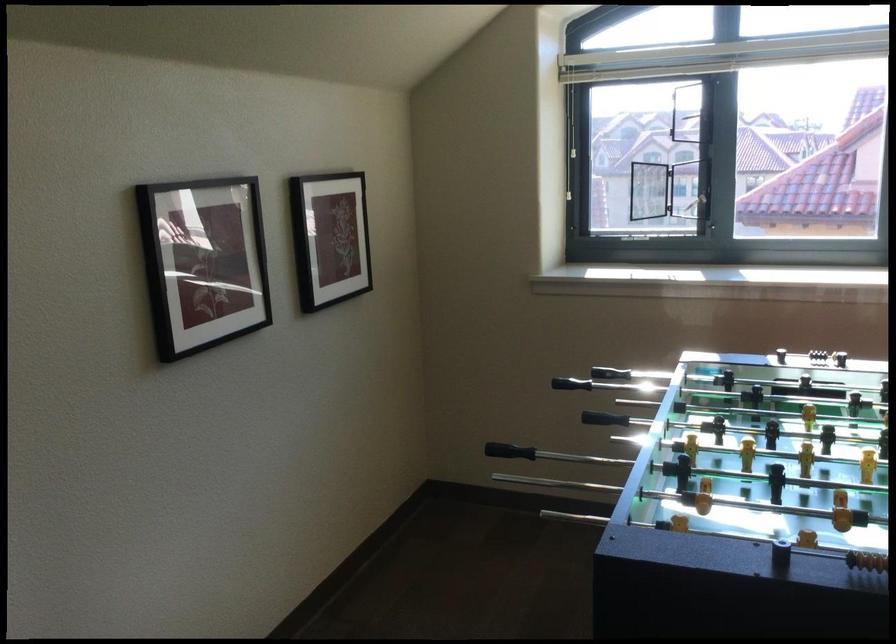
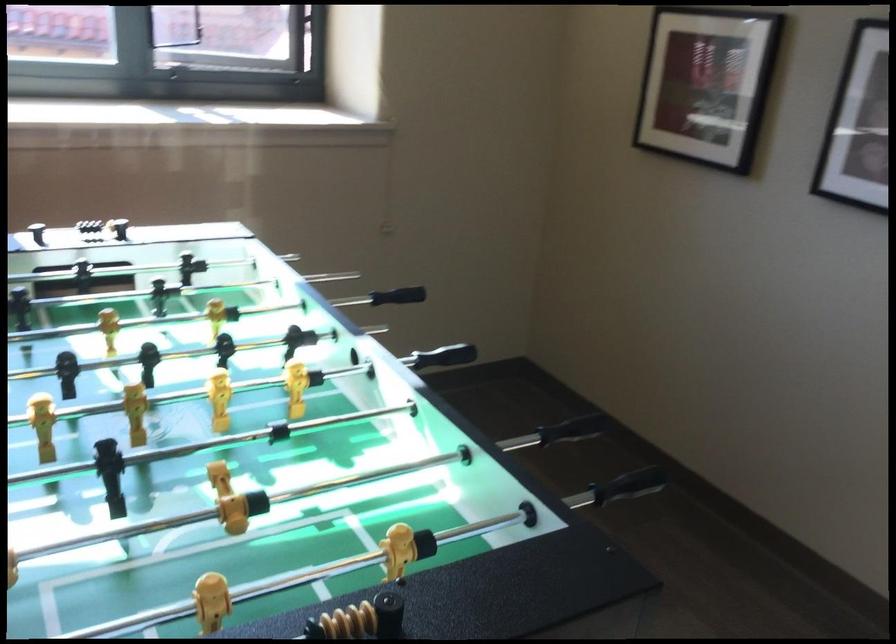
Question: The first image is from the beginning of the video and the second image is from the end. How did the camera likely rotate when shooting the video?

Choices:
 (A) Left
 (B) Right
 (C) Up
 (D) Down

Answer: (B)